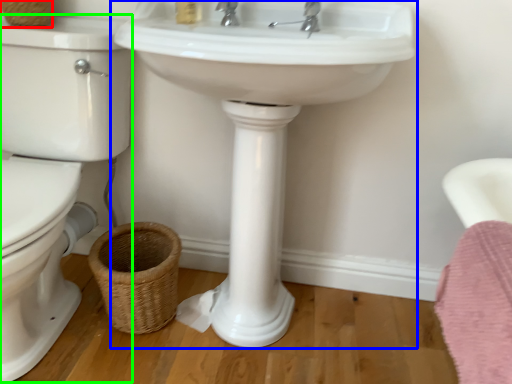
Question: Which object is the closest to the basket (highlighted by a red box)? Choose among these: sink (highlighted by a blue box) or toilet bowl (highlighted by a green box).

Choices:
 (A) sink
 (B) toilet bowl

Answer: (B)